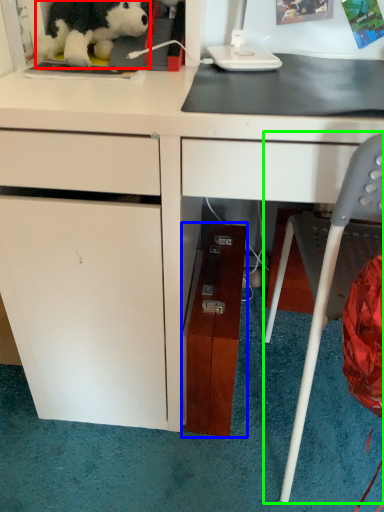
Question: Based on their relative distances, which object is farther from toy (highlighted by a red box)? Choose from file cabinet (highlighted by a blue box) and chair (highlighted by a green box).

Choices:
 (A) file cabinet
 (B) chair

Answer: (B)